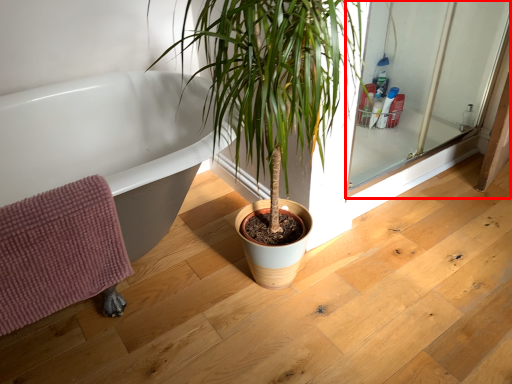
Question: Where is screen door (annotated by the red box) located in relation to bath towel in the image?

Choices:
 (A) right
 (B) left

Answer: (A)